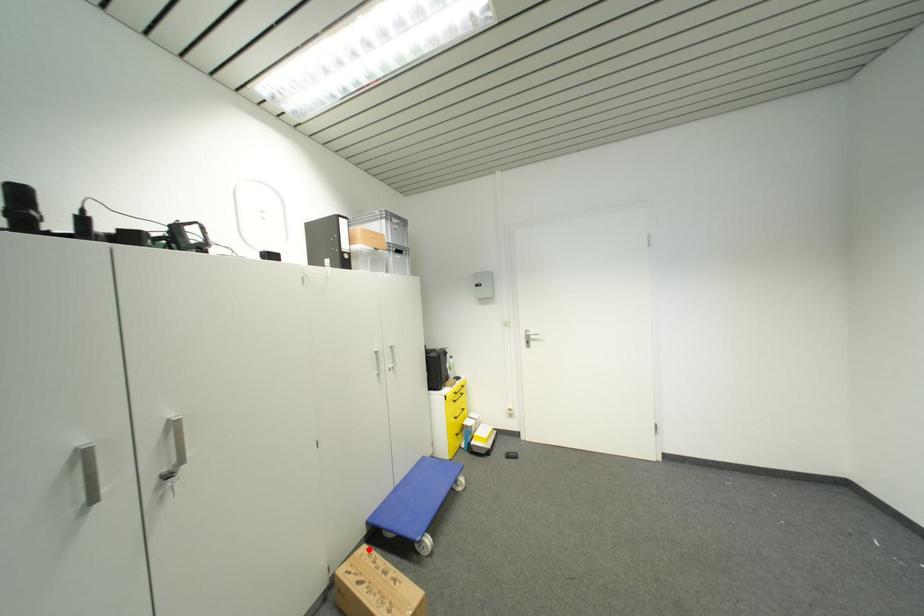
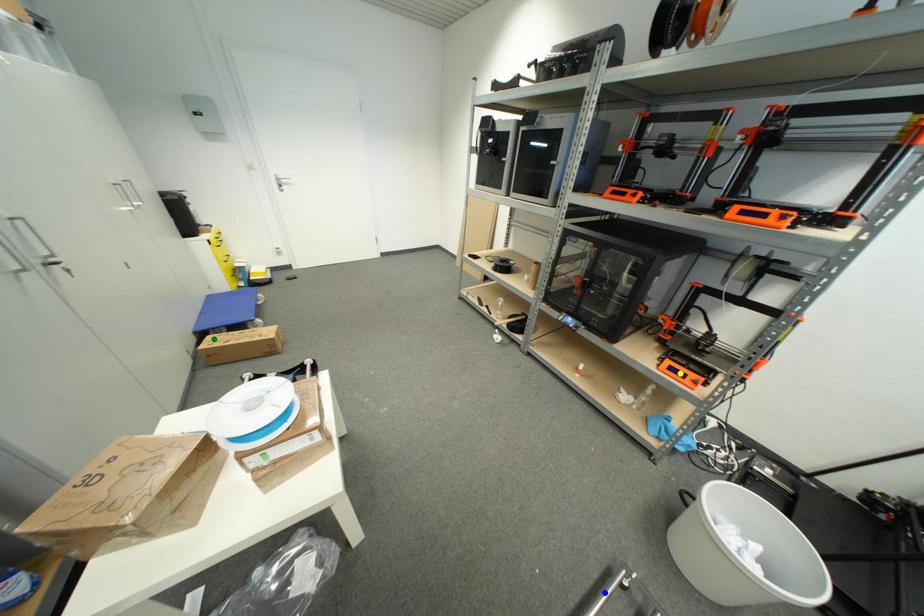
Question: I am providing you with two images of the same scene from different viewpoints. A red point is marked on the first image. You are given multiple points on the second image. Can you choose the point in image 2 that corresponds to the point in image 1?

Choices:
 (A) blue point
 (B) yellow point
 (C) green point

Answer: (C)